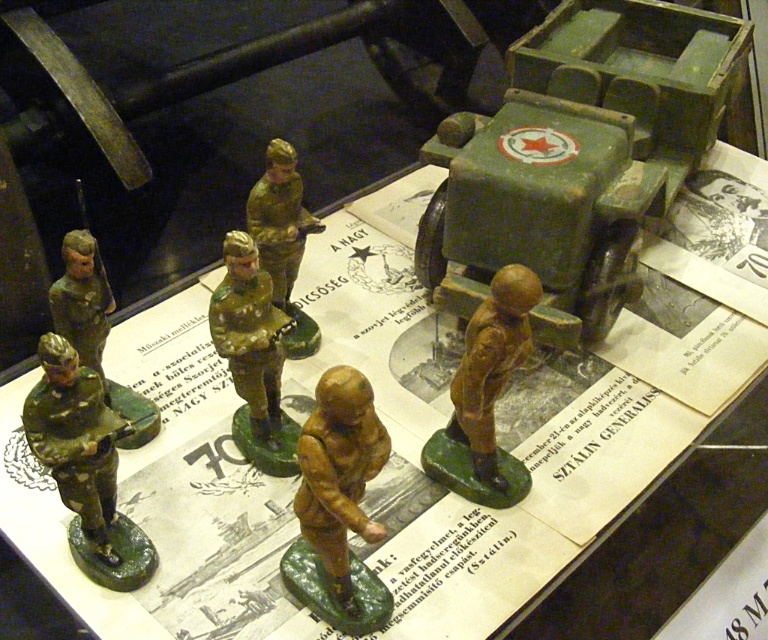
You are a curator arranging a miniature military exhibit. You need to place a new toy tank exactly 0.1 units to the right of the green matte toy soldier at lower left. What coordinates should you use for the tank?

The green matte toy soldier at lower left is at point (85, 465). Adding 0.1 to the x coordinate gives 0.828, so the tank should be placed at coordinates (85, 529).

You are a curator arranging an exhibit and need to place both the green matte toy soldier at lower left and the matte green soldier at left on a shelf. Given their sizes, which one should you place first to ensure they fit properly?

The green matte toy soldier at lower left occupies less space than the matte green soldier at left, so you should place the larger matte green soldier at left first to ensure proper fitting on the shelf.

You are a museum curator setting up an exhibit. You need to place the matte green truck at center and the brown matte figure at center on a shelf. The shelf has a height limit of 12 inches. Can both items fit vertically without exceeding the height limit?

The matte green truck at center is bigger than the brown matte figure at center. However, the exact heights of each item are not provided in the description. Therefore, it is uncertain if both items will fit within the 12 inch height limit without more specific measurements.